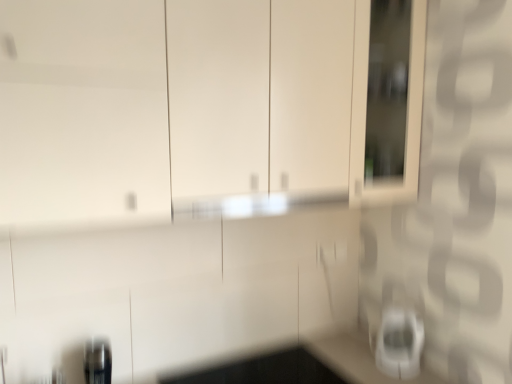
Question: In the image, is white glossy coffee maker at lower right positioned in front of or behind black glossy counter top at lower center?

Choices:
 (A) behind
 (B) front

Answer: (A)

Question: From the image's perspective, is white glossy coffee maker at lower right above or below black glossy counter top at lower center?

Choices:
 (A) above
 (B) below

Answer: (A)

Question: Considering the positions of white glossy coffee maker at lower right and black glossy counter top at lower center in the image, is white glossy coffee maker at lower right bigger or smaller than black glossy counter top at lower center?

Choices:
 (A) small
 (B) big

Answer: (A)

Question: From a real-world perspective, is black glossy counter top at lower center above or below white glossy coffee maker at lower right?

Choices:
 (A) above
 (B) below

Answer: (B)

Question: Is black glossy counter top at lower center inside or outside of white glossy coffee maker at lower right?

Choices:
 (A) inside
 (B) outside

Answer: (B)

Question: In the image, is black glossy counter top at lower center positioned in front of or behind white glossy coffee maker at lower right?

Choices:
 (A) front
 (B) behind

Answer: (A)

Question: Is black glossy counter top at lower center taller or shorter than white glossy coffee maker at lower right?

Choices:
 (A) tall
 (B) short

Answer: (B)